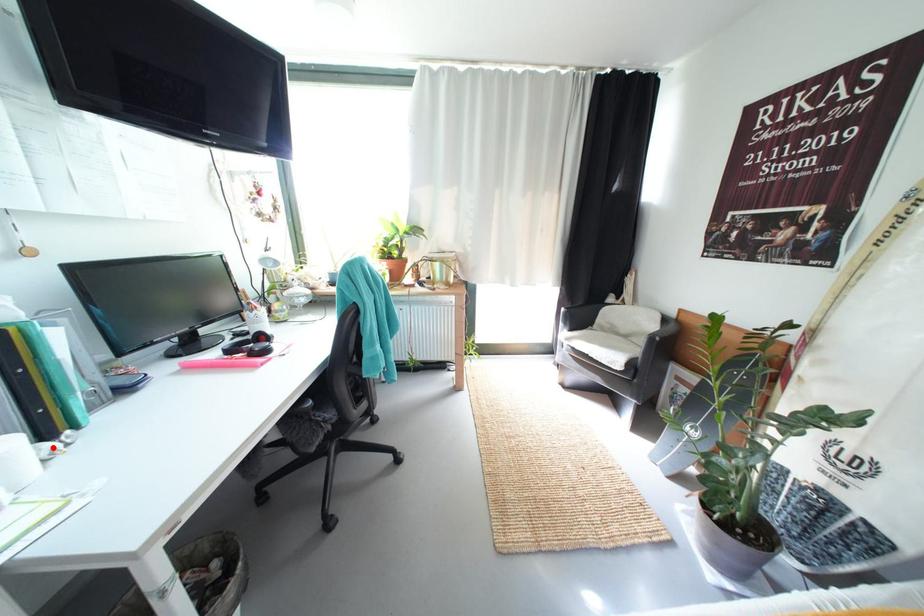
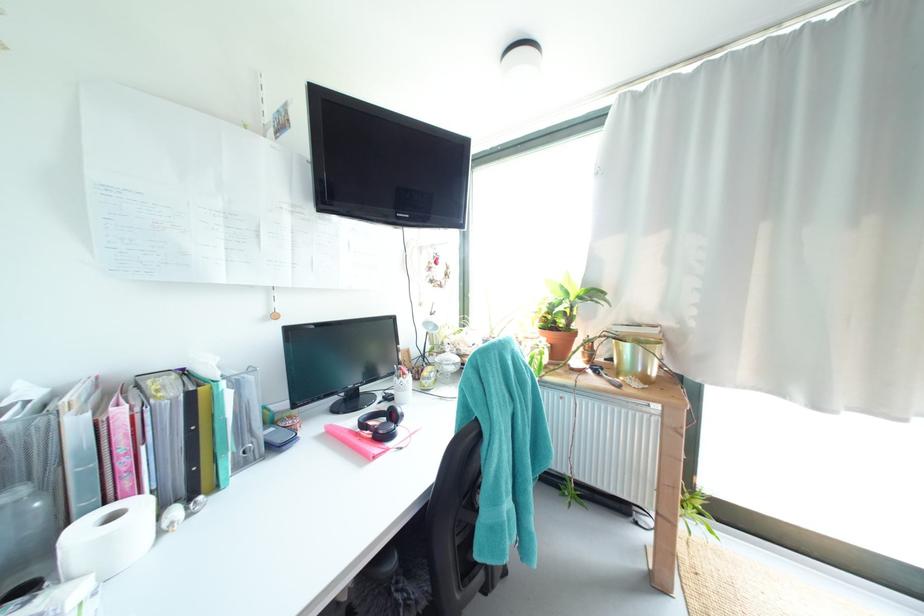
The point at the highlighted location is marked in the first image. Where is the corresponding point in the second image?

(185, 513)